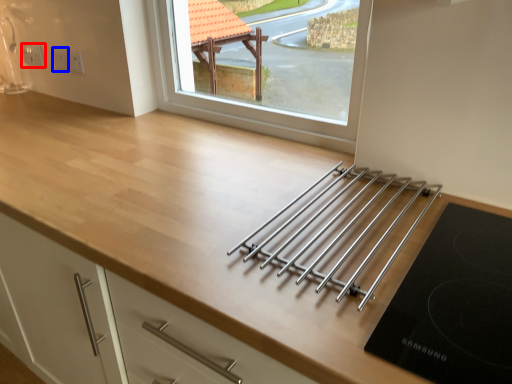
Question: Which point is further to the camera, electric outlet (highlighted by a red box) or electric outlet (highlighted by a blue box)?

Choices:
 (A) electric outlet
 (B) electric outlet

Answer: (A)